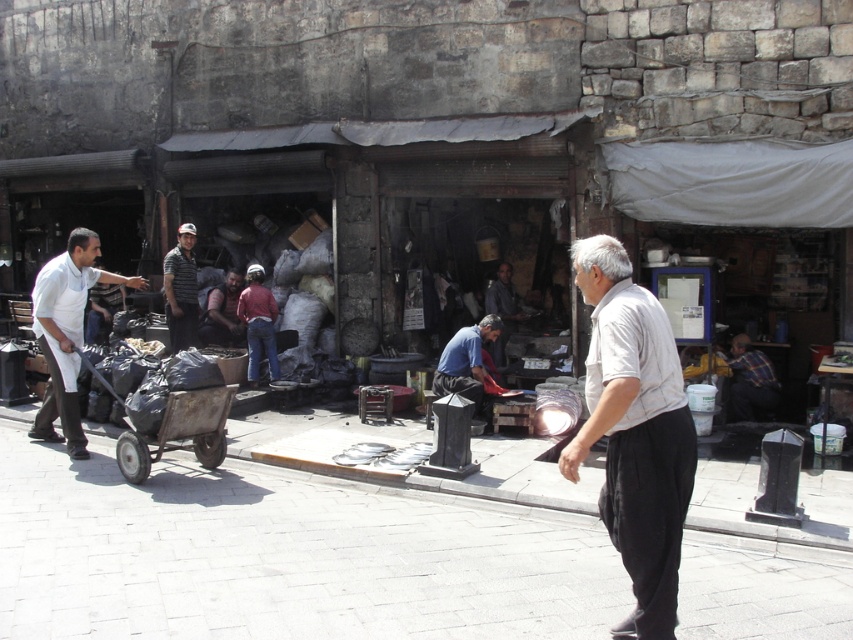
Which is more to the right, striped shirt at center or rusty metal man at center?

rusty metal man at center

What do you see at coordinates (181, 291) in the screenshot? The image size is (853, 640). I see `striped shirt at center` at bounding box center [181, 291].

Who is more forward, (172,332) or (236,298)?

Point (172,332) is more forward.

The height and width of the screenshot is (640, 853). I want to click on striped shirt at center, so click(x=181, y=291).

Looking at this image, which is above, striped shirt at center or red shirt at center?

Positioned higher is striped shirt at center.

You are a GUI agent. You are given a task and a screenshot of the screen. Output one action in this format:
    pyautogui.click(x=<x>, y=<y>)
    Task: Click on the striped shirt at center
    The height and width of the screenshot is (640, 853).
    Given the screenshot: What is the action you would take?
    pyautogui.click(x=181, y=291)

Is point (178, 266) farther from camera compared to point (271, 330)?

No, it is not.

Locate an element on the screen. striped shirt at center is located at coordinates (181, 291).

Who is positioned more to the right, rusty metal cart at center-left or plaid shirt at right?

From the viewer's perspective, plaid shirt at right appears more on the right side.

Between rusty metal cart at center-left and plaid shirt at right, which one appears on the left side from the viewer's perspective?

rusty metal cart at center-left

What do you see at coordinates (178, 429) in the screenshot? This screenshot has height=640, width=853. I see `rusty metal cart at center-left` at bounding box center [178, 429].

Find the location of a particular element. The height and width of the screenshot is (640, 853). rusty metal cart at center-left is located at coordinates (178, 429).